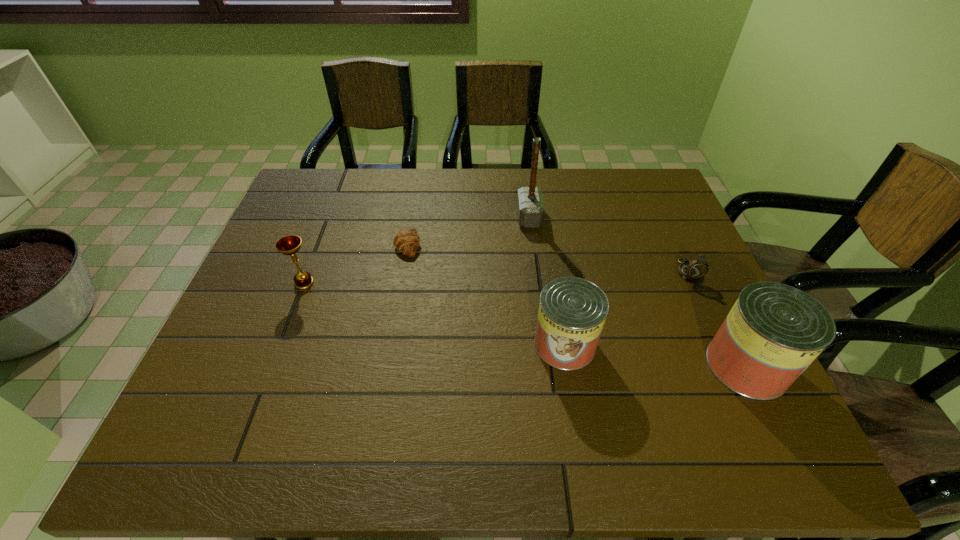
The height and width of the screenshot is (540, 960). In order to click on compass that is at the right edge in this screenshot , I will do tap(697, 268).

Where is `object that is at the near right corner`? object that is at the near right corner is located at coordinates (774, 331).

This screenshot has width=960, height=540. Identify the location of vacant space at the far edge. (419, 180).

This screenshot has height=540, width=960. Find the location of `vacant space at the near edge of the desktop`. vacant space at the near edge of the desktop is located at coordinates coord(303,384).

In the image, there is a desktop. Where is `blank space at the left edge`? The height and width of the screenshot is (540, 960). blank space at the left edge is located at coordinates (296, 232).

In the image, there is a desktop. What are the coordinates of `vacant space at the right edge` in the screenshot? It's located at (722, 305).

Find the location of a particular element. The image size is (960, 540). free region at the near left corner of the desktop is located at coordinates (204, 397).

At what (x,y) coordinates should I click in order to perform the action: click on vacant space in between the taller can and the hammer. Please return your answer as a coordinate pair (x, y). The width and height of the screenshot is (960, 540). Looking at the image, I should click on (638, 291).

In order to click on empty location between the taller can and the tallest object in this screenshot , I will do `click(638, 291)`.

Identify the location of vacant space that is in between the taller can and the leftmost object. The width and height of the screenshot is (960, 540). (525, 324).